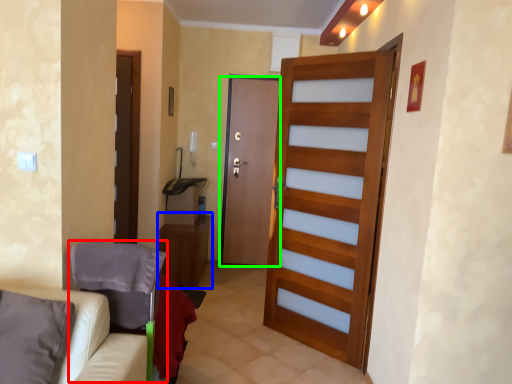
Question: Which object is the farthest from armchair (highlighted by a red box)? Choose among these: table (highlighted by a blue box) or door (highlighted by a green box).

Choices:
 (A) table
 (B) door

Answer: (B)